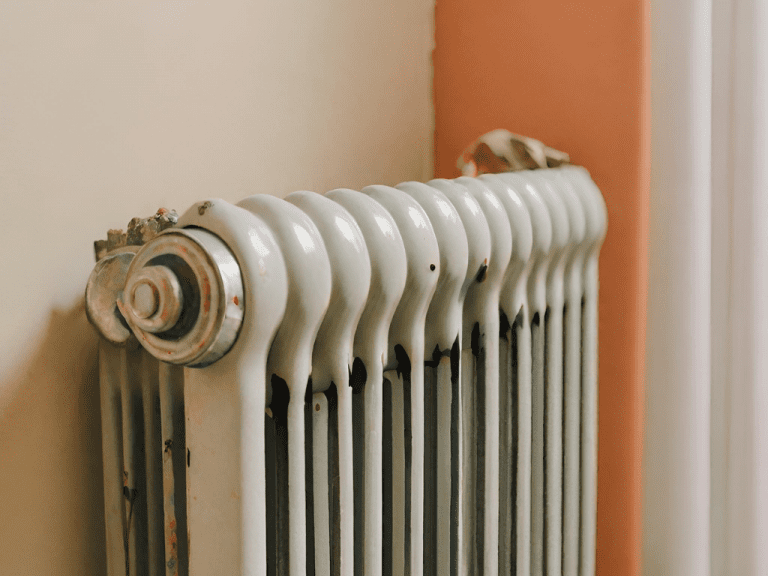
At what (x,y) coordinates should I click in order to perform the action: click on wall. Please return your answer as a coordinate pair (x, y). Image resolution: width=768 pixels, height=576 pixels. Looking at the image, I should click on (147, 150).